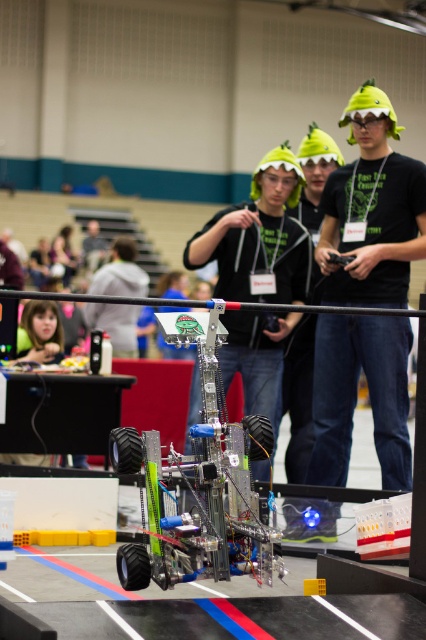
You are a spectator at the robotics event and notice the green matte hat at upper center and the gray fabric shirt at center. Which object is taller?

The green matte hat at upper center is taller than the gray fabric shirt at center.